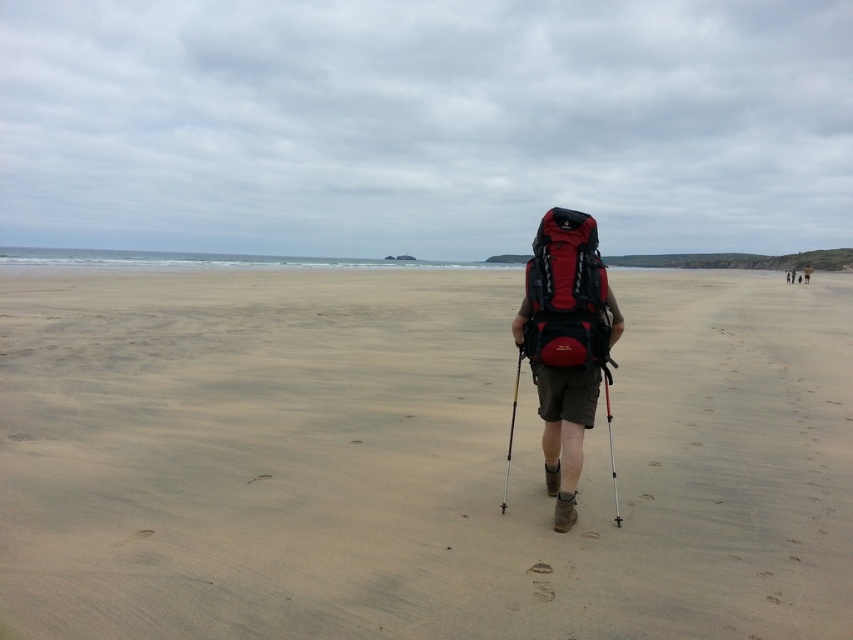
Question: Is matte red backpack at center bigger than matte black backpack at center?

Choices:
 (A) yes
 (B) no

Answer: (B)

Question: Which point appears farthest from the camera in this image?

Choices:
 (A) (544, 464)
 (B) (558, 276)

Answer: (A)

Question: Which is nearer to the matte black backpack at center?

Choices:
 (A) red matte backpack at center
 (B) matte red backpack at center
 (C) smooth sand at center

Answer: (C)

Question: Is red matte backpack at center wider than matte black backpack at center?

Choices:
 (A) no
 (B) yes

Answer: (A)

Question: Which object is positioned farthest from the matte black backpack at center?

Choices:
 (A) smooth sand at center
 (B) matte red backpack at center
 (C) red matte backpack at center

Answer: (B)

Question: Is the position of smooth sand at center less distant than that of red matte backpack at center?

Choices:
 (A) no
 (B) yes

Answer: (B)